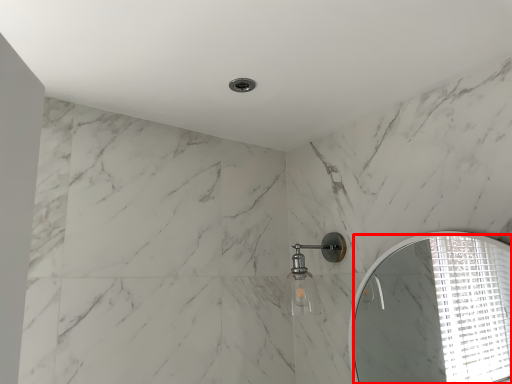
Question: Where is mirror (annotated by the red box) located in relation to shower in the image?

Choices:
 (A) right
 (B) left

Answer: (A)